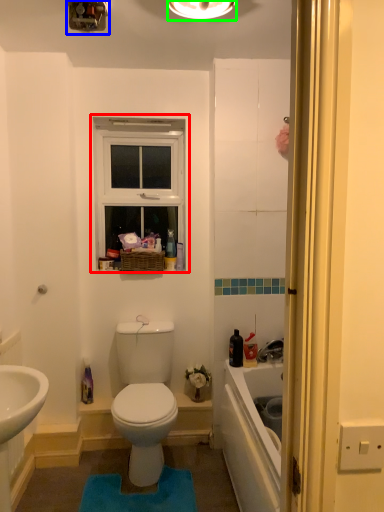
Question: Considering the real-world distances, which object is farthest from window (highlighted by a red box)? light fixture (highlighted by a blue box) or light fixture (highlighted by a green box)?

Choices:
 (A) light fixture
 (B) light fixture

Answer: (B)